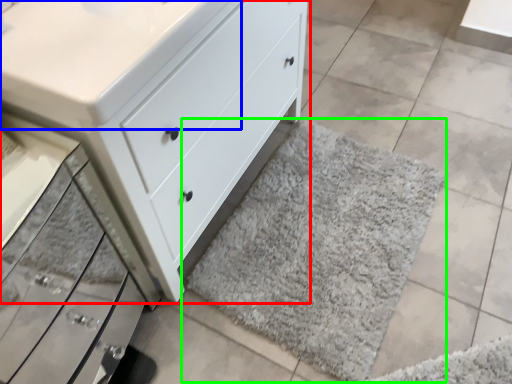
Question: Which object is positioned closest to chest of drawers (highlighted by a red box)? Select from counter top (highlighted by a blue box) and bath mat (highlighted by a green box).

Choices:
 (A) counter top
 (B) bath mat

Answer: (A)